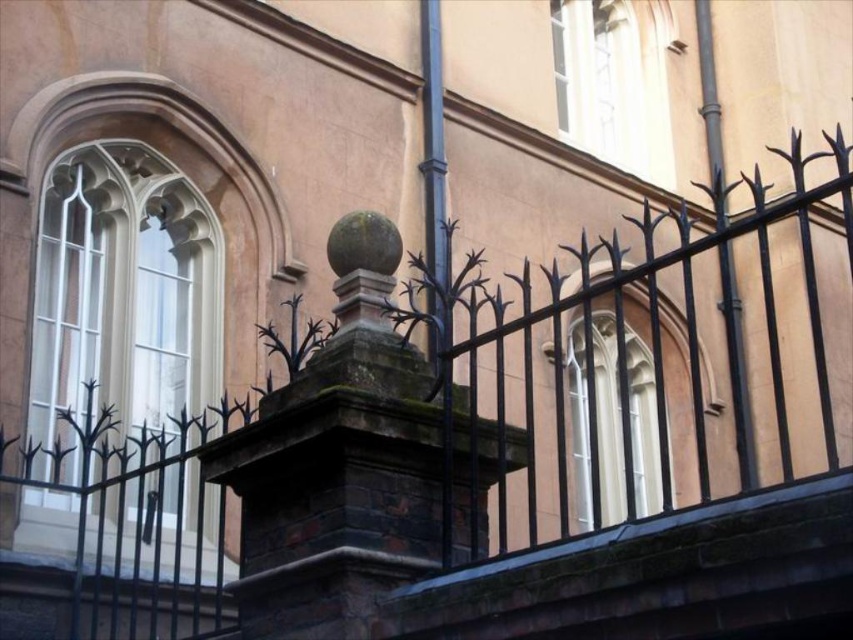
Question: Can you confirm if white glass window at upper left is positioned below clear glass window at upper center?

Choices:
 (A) no
 (B) yes

Answer: (B)

Question: Which object appears closest to the camera in this image?

Choices:
 (A) clear glass window at center
 (B) smooth metal pole at right
 (C) clear glass window at upper center
 (D) white glass window at upper left

Answer: (A)

Question: Is clear glass window at upper center to the right of clear glass window at center from the viewer's perspective?

Choices:
 (A) no
 (B) yes

Answer: (B)

Question: Does white glass window at upper left come in front of clear glass window at upper center?

Choices:
 (A) yes
 (B) no

Answer: (A)

Question: Among these objects, which one is nearest to the camera?

Choices:
 (A) clear glass window at upper center
 (B) smooth metal pole at right
 (C) white glass window at upper left
 (D) clear glass window at center

Answer: (D)

Question: Which point appears closest to the camera in this image?

Choices:
 (A) (65, 502)
 (B) (619, 435)
 (C) (577, 108)

Answer: (A)